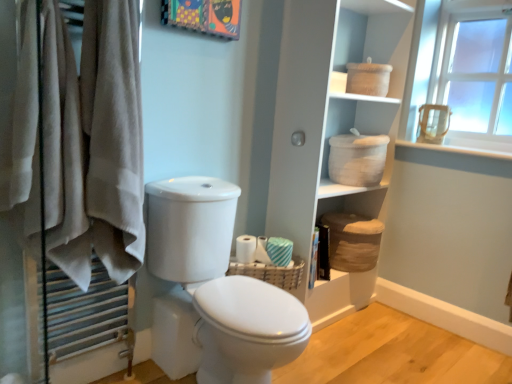
Question: From a real-world perspective, is white woven baskets at upper center physically located above or below white textured toilet paper at center, arranged as the first toilet paper when viewed from the left?

Choices:
 (A) below
 (B) above

Answer: (B)

Question: Is white woven baskets at upper center taller or shorter than white textured toilet paper at center, arranged as the first toilet paper when viewed from the left?

Choices:
 (A) short
 (B) tall

Answer: (B)

Question: Which object is positioned farthest from the white textured toilet paper at center, arranged as the first toilet paper when viewed from the left?

Choices:
 (A) white fabric towels at left
 (B) beige cotton towel at left
 (C) white striped fabric at right, acting as the 1th toilet paper starting from the right
 (D) white glossy toilet at center
 (E) white woven baskets at upper center

Answer: (A)

Question: Which object is positioned closest to the brown woven basket at lower center, the second basket in the front-to-back sequence?

Choices:
 (A) white glossy toilet at center
 (B) white woven basket at upper right
 (C) woven brown basket at center, marked as the second basket in a back-to-front arrangement
 (D) white glossy toilet at center
 (E) white textured toilet paper at center, placed as the 2th toilet paper when sorted from right to left

Answer: (B)